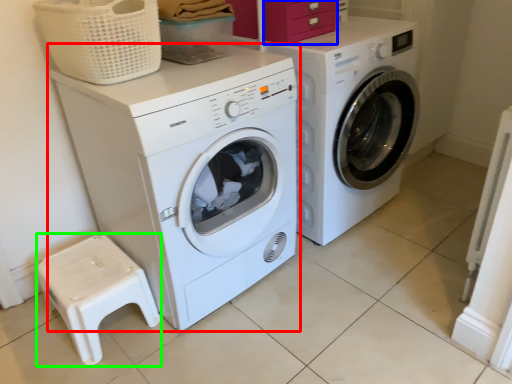
Question: Estimate the real-world distances between objects in this image. Which object is farther from washing machine (highlighted by a red box), drawer (highlighted by a blue box) or step stool (highlighted by a green box)?

Choices:
 (A) drawer
 (B) step stool

Answer: (A)